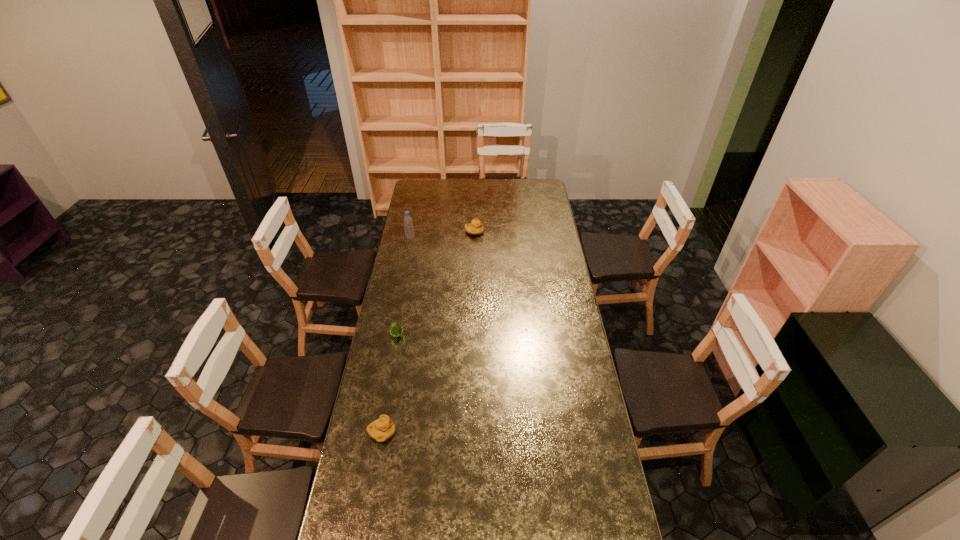
The width and height of the screenshot is (960, 540). I want to click on free point between the left duckling and the rightmost object, so click(x=428, y=332).

In order to click on vacant space in between the second nearest object and the left duckling in this screenshot , I will do `click(390, 384)`.

Identify the location of free spot between the avocado and the tallest object. The image size is (960, 540). (403, 287).

The image size is (960, 540). What are the coordinates of `free space between the left duckling and the avocado` in the screenshot? It's located at (390, 384).

Where is `vacant space that's between the farther duckling and the tallest object`? vacant space that's between the farther duckling and the tallest object is located at coordinates (443, 235).

Locate an element on the screen. object that is the closest one to the left duckling is located at coordinates (395, 329).

Select which object appears as the closest to the avocado. Please provide its 2D coordinates. Your answer should be formatted as a tuple, i.e. [(x, y)], where the tuple contains the x and y coordinates of a point satisfying the conditions above.

[(383, 428)]

Locate an element on the screen. duckling that is the closest one to the second nearest object is located at coordinates (383, 428).

Point out which duckling is positioned as the second nearest to the tallest object. Please provide its 2D coordinates. Your answer should be formatted as a tuple, i.e. [(x, y)], where the tuple contains the x and y coordinates of a point satisfying the conditions above.

[(383, 428)]

Locate an element on the screen. The width and height of the screenshot is (960, 540). vacant region that satisfies the following two spatial constraints: 1. on the front-facing side of the farther duckling; 2. on the front side of the bottle is located at coordinates (474, 238).